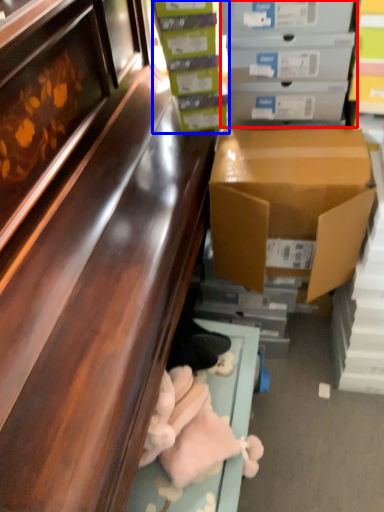
Question: Among these objects, which one is farthest to the camera, box (highlighted by a red box) or box (highlighted by a blue box)?

Choices:
 (A) box
 (B) box

Answer: (B)